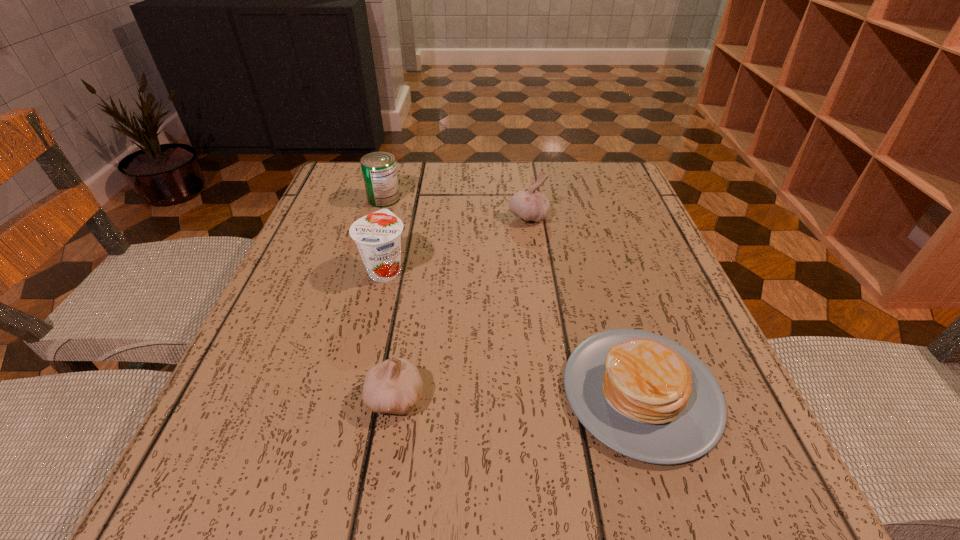
Where is `free space at the far edge of the desktop`? This screenshot has width=960, height=540. free space at the far edge of the desktop is located at coordinates (512, 185).

The width and height of the screenshot is (960, 540). In the image, there is a desktop. In order to click on vacant space at the left edge in this screenshot , I will do `click(327, 281)`.

You are a GUI agent. You are given a task and a screenshot of the screen. Output one action in this format:
    pyautogui.click(x=<x>, y=<y>)
    Task: Click on the blank area at the right edge
    This screenshot has width=960, height=540.
    Given the screenshot: What is the action you would take?
    pyautogui.click(x=666, y=337)

Locate an element on the screen. Image resolution: width=960 pixels, height=540 pixels. free point at the far left corner is located at coordinates (323, 197).

Where is `blank area at the near left corner`? blank area at the near left corner is located at coordinates (239, 450).

Where is `vacant space at the near right corner of the desktop`? The height and width of the screenshot is (540, 960). vacant space at the near right corner of the desktop is located at coordinates (732, 462).

This screenshot has height=540, width=960. I want to click on vacant area between the third nearest object and the pancake, so click(x=513, y=330).

Find the location of a particular element. This screenshot has height=540, width=960. free space between the pancake and the can is located at coordinates (513, 295).

I want to click on free spot between the can and the right garlic, so click(456, 208).

Locate an element on the screen. free space that is in between the shortest object and the farther garlic is located at coordinates (585, 305).